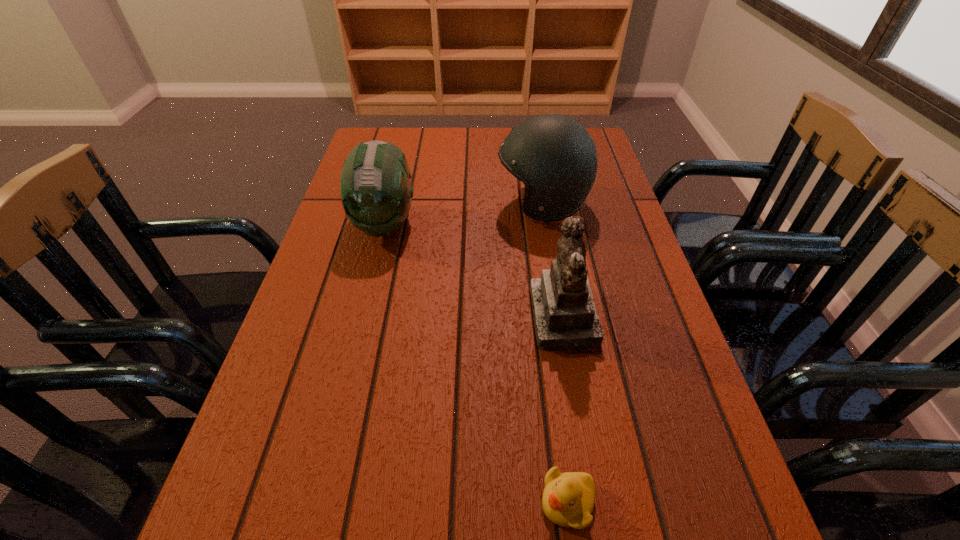
You are a GUI agent. You are given a task and a screenshot of the screen. Output one action in this format:
    pyautogui.click(x=<x>, y=<y>)
    Task: Click on the free space at the right edge of the desktop
    
    Given the screenshot: What is the action you would take?
    pyautogui.click(x=670, y=326)

The width and height of the screenshot is (960, 540). In order to click on free point between the nearest object and the figurine in this screenshot , I will do `click(565, 410)`.

Locate an element on the screen. free space that is in between the second nearest object and the shortest object is located at coordinates (565, 410).

Where is `empty space between the second nearest object and the shortest object`? empty space between the second nearest object and the shortest object is located at coordinates (565, 410).

You are a GUI agent. You are given a task and a screenshot of the screen. Output one action in this format:
    pyautogui.click(x=<x>, y=<y>)
    Task: Click on the empty space between the figurine and the shorter football helmet
    The height and width of the screenshot is (540, 960).
    Given the screenshot: What is the action you would take?
    pyautogui.click(x=474, y=271)

Locate an element on the screen. This screenshot has width=960, height=540. blank region between the right football helmet and the leftmost object is located at coordinates (464, 214).

Locate an element on the screen. This screenshot has width=960, height=540. free space between the figurine and the duckling is located at coordinates (565, 410).

The height and width of the screenshot is (540, 960). Identify the location of vacant space that's between the shorter football helmet and the right football helmet. (464, 214).

At what (x,y) coordinates should I click in order to perform the action: click on the second closest object relative to the right football helmet. Please return your answer as a coordinate pair (x, y). The height and width of the screenshot is (540, 960). Looking at the image, I should click on (376, 192).

Select which object appears as the second closest to the duckling. Please provide its 2D coordinates. Your answer should be formatted as a tuple, i.e. [(x, y)], where the tuple contains the x and y coordinates of a point satisfying the conditions above.

[(376, 192)]